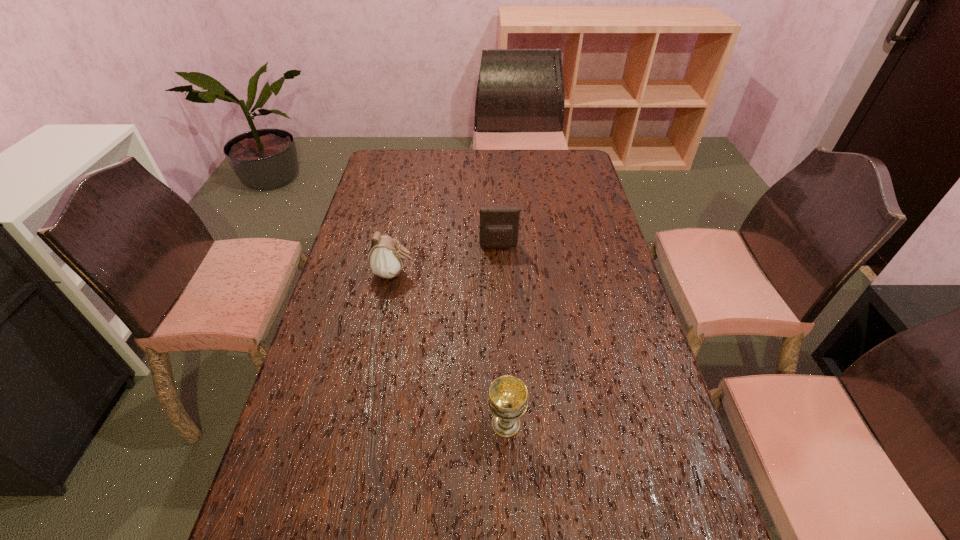
Locate an element on the screen. vacant area that lies between the leftmost object and the farther pouch is located at coordinates (446, 260).

Find the location of a particular element. The width and height of the screenshot is (960, 540). vacant point located between the chalice and the farthest object is located at coordinates (502, 335).

You are a GUI agent. You are given a task and a screenshot of the screen. Output one action in this format:
    pyautogui.click(x=<x>, y=<y>)
    Task: Click on the empty space between the nearer pouch and the right pouch
    The width and height of the screenshot is (960, 540).
    Given the screenshot: What is the action you would take?
    pyautogui.click(x=446, y=260)

Identify which object is the nearest to the nearest object. Please provide its 2D coordinates. Your answer should be formatted as a tuple, i.e. [(x, y)], where the tuple contains the x and y coordinates of a point satisfying the conditions above.

[(386, 256)]

Where is `object that ranks as the closest to the chalice`? This screenshot has width=960, height=540. object that ranks as the closest to the chalice is located at coordinates (386, 256).

Where is `free space that satisfies the following two spatial constraints: 1. with an open flap on the right pouch; 2. on the front-facing side of the leftmost object`? The width and height of the screenshot is (960, 540). free space that satisfies the following two spatial constraints: 1. with an open flap on the right pouch; 2. on the front-facing side of the leftmost object is located at coordinates (500, 273).

The height and width of the screenshot is (540, 960). I want to click on vacant space that satisfies the following two spatial constraints: 1. on the front-facing side of the nearest object; 2. on the left side of the leftmost object, so click(x=363, y=424).

Where is `free location that satisfies the following two spatial constraints: 1. on the front-facing side of the leftmost object; 2. on the right side of the chalice`? free location that satisfies the following two spatial constraints: 1. on the front-facing side of the leftmost object; 2. on the right side of the chalice is located at coordinates (363, 424).

Locate an element on the screen. Image resolution: width=960 pixels, height=540 pixels. vacant space that satisfies the following two spatial constraints: 1. on the front-facing side of the nearest object; 2. on the left side of the nearer pouch is located at coordinates (363, 424).

Where is `vacant point that satisfies the following two spatial constraints: 1. on the front-facing side of the left pouch; 2. on the back side of the chalice`? vacant point that satisfies the following two spatial constraints: 1. on the front-facing side of the left pouch; 2. on the back side of the chalice is located at coordinates (363, 424).